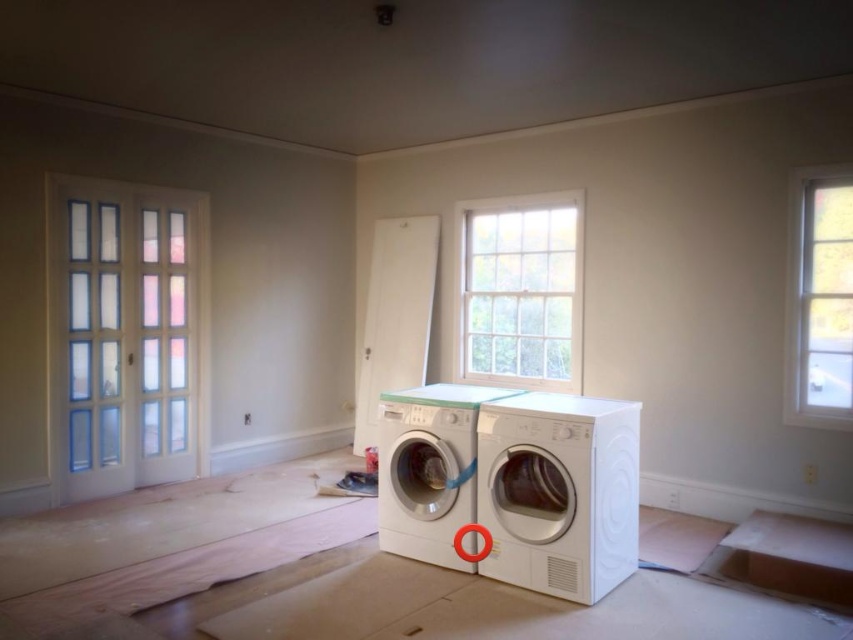
Question: Can you confirm if white glossy washer at center is bigger than white glossy washing machine at center?

Choices:
 (A) no
 (B) yes

Answer: (B)

Question: Among these points, which one is farthest from the camera?

Choices:
 (A) (474, 257)
 (B) (402, 452)
 (C) (570, 573)
 (D) (809, 180)

Answer: (A)

Question: From the image, what is the correct spatial relationship of white wooden window at upper center in relation to clear glass window at upper right?

Choices:
 (A) left
 (B) right

Answer: (A)

Question: Can you confirm if white glossy washing machine at center is thinner than clear glass window at upper right?

Choices:
 (A) no
 (B) yes

Answer: (A)

Question: Which object is the closest to the white glossy washing machine at center?

Choices:
 (A) white glossy washer at center
 (B) clear glass window at upper right

Answer: (A)

Question: Which point appears farthest from the camera in this image?

Choices:
 (A) (486, 310)
 (B) (421, 403)
 (C) (486, 486)
 (D) (793, 368)

Answer: (A)